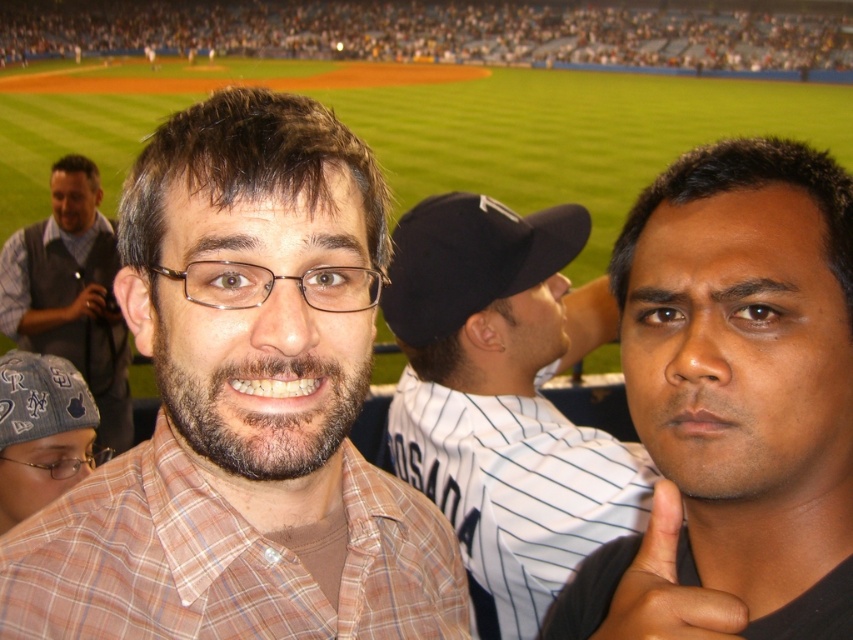
Is point (270, 305) positioned behind point (735, 625)?

That is True.

Does plaid shirt at center appear on the right side of dark skin textured hand at right?

In fact, plaid shirt at center is to the left of dark skin textured hand at right.

Locate an element on the screen. plaid shirt at center is located at coordinates (244, 406).

Is point (479, 358) more distant than point (90, 305)?

No, (479, 358) is in front of (90, 305).

Based on the photo, does white pinstriped jersey at center have a larger size compared to black matte camera at upper left?

Yes, white pinstriped jersey at center is bigger than black matte camera at upper left.

In order to click on white pinstriped jersey at center in this screenshot , I will do `click(503, 397)`.

Where is `white pinstriped jersey at center`? The image size is (853, 640). white pinstriped jersey at center is located at coordinates (503, 397).

In the scene shown: Does dark skin smooth face at center come behind white pinstriped jersey at center?

No, dark skin smooth face at center is closer to the viewer.

Which is behind, point (792, 509) or point (407, 259)?

The point (407, 259) is more distant.

Which is in front, point (656, 586) or point (468, 276)?

Positioned in front is point (656, 586).

This screenshot has height=640, width=853. What are the coordinates of `dark skin smooth face at center` in the screenshot? It's located at (733, 403).